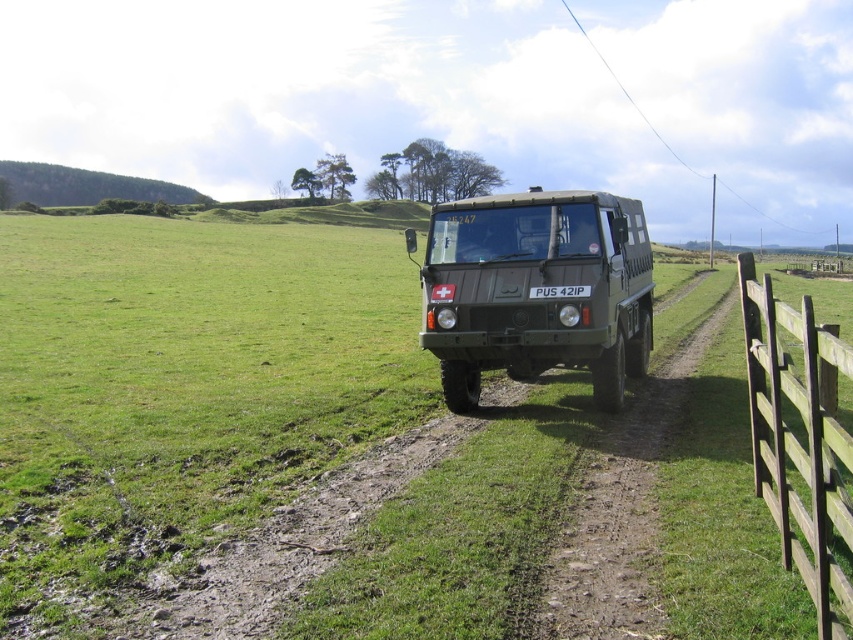
Consider the image. Can you confirm if brown wooden fence at right is taller than white plastic license plate at center?

Yes, brown wooden fence at right is taller than white plastic license plate at center.

Is brown wooden fence at right below white plastic license plate at center?

Yes, brown wooden fence at right is below white plastic license plate at center.

Is point (775, 422) positioned in front of point (573, 291)?

Yes, point (775, 422) is closer to viewer.

Where is `brown wooden fence at right`? brown wooden fence at right is located at coordinates (798, 440).

Does point (624, 371) lie behind point (769, 508)?

Yes, point (624, 371) is behind point (769, 508).

Who is more distant from viewer, (607, 273) or (788, 444)?

The point (607, 273) is behind.

What do you see at coordinates (537, 285) in the screenshot? I see `matte green truck at center` at bounding box center [537, 285].

Where is `matte green truck at center`? matte green truck at center is located at coordinates (537, 285).

Identify the location of matte green truck at center. This screenshot has width=853, height=640. (537, 285).

Does matte green truck at center appear on the right side of white plastic license plate at center?

Correct, you'll find matte green truck at center to the right of white plastic license plate at center.

Which is in front, point (474, 378) or point (579, 289)?

Point (579, 289)

This screenshot has width=853, height=640. I want to click on matte green truck at center, so click(537, 285).